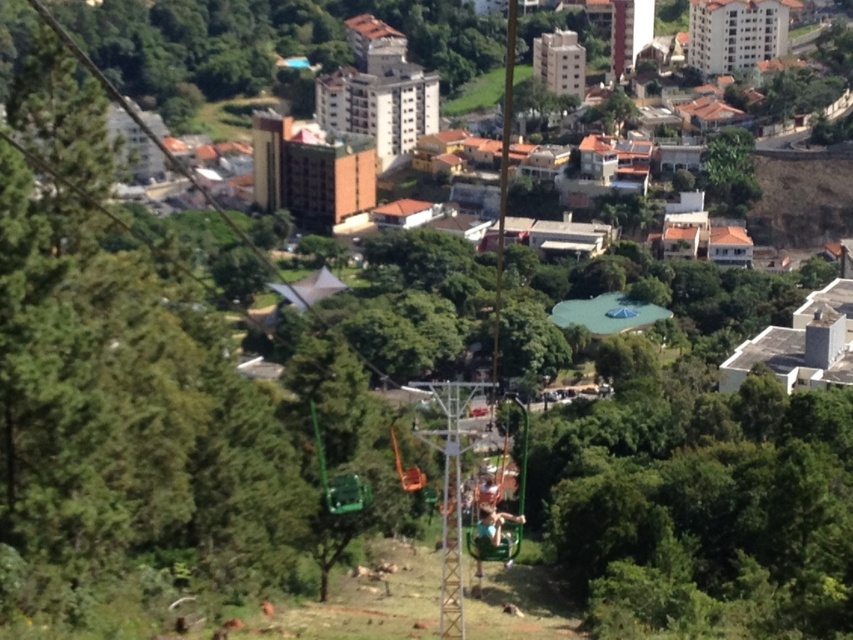
You are a bird flying over the scenic area and want to land on the nearest green leafy tree. Which tree should you choose between the green leafy tree at center and the green leafy tree at upper right?

The green leafy tree at center has a larger width than the green leafy tree at upper right, so it is more likely to provide a stable landing spot for the bird.

You are a bird flying over the scenic area. You want to land on the closest green leafy tree. Which tree should you choose between the green leafy tree at center and the green leafy tree at upper right?

The green leafy tree at center is larger in size compared to the green leafy tree at upper right, but size does not determine distance. Since the question is about the closest tree, the spatial description provided does not give information about their distances from the bird. Therefore, I cannot determine which tree is closer based on the given information.